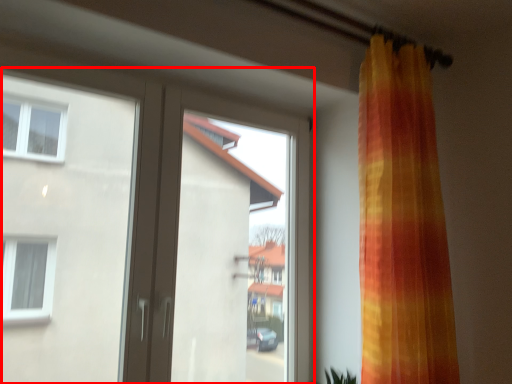
Question: From the image's perspective, considering the relative positions of door (annotated by the red box) and window screen in the image provided, where is door (annotated by the red box) located with respect to the staircase?

Choices:
 (A) above
 (B) below

Answer: (A)